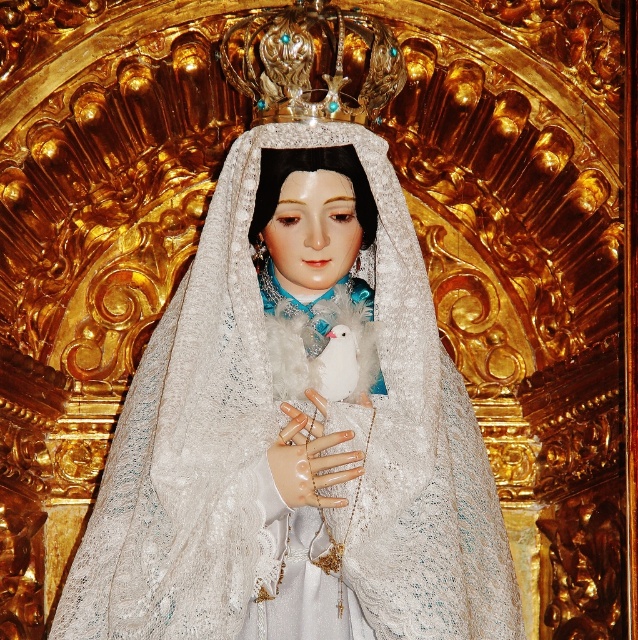
This screenshot has height=640, width=638. What are the coordinates of `lace fabric at center` in the screenshot? It's located at (297, 394).

Who is more distant from viewer, (508, 560) or (286, 490)?

Positioned behind is point (508, 560).

Does point (413, 340) come in front of point (297, 460)?

No.

You are a GUI agent. You are given a task and a screenshot of the screen. Output one action in this format:
    pyautogui.click(x=<x>, y=<y>)
    Task: Click on the lace fabric at center
    Image resolution: width=638 pixels, height=640 pixels.
    Given the screenshot: What is the action you would take?
    pyautogui.click(x=297, y=394)

Does smooth porcelain hand at center have a larger size compared to white fluffy bird at center?

No.

Does smooth porcelain hand at center have a lesser width compared to white fluffy bird at center?

Yes, smooth porcelain hand at center is thinner than white fluffy bird at center.

Describe the element at coordinates (309, 461) in the screenshot. This screenshot has width=638, height=640. I see `smooth porcelain hand at center` at that location.

Image resolution: width=638 pixels, height=640 pixels. I want to click on smooth porcelain hand at center, so click(x=309, y=461).

Measure the distance from lace fabric at center to white fluffy bird at center.

lace fabric at center and white fluffy bird at center are 6.22 meters apart.

Which is below, lace fabric at center or white fluffy bird at center?

white fluffy bird at center is lower down.

You are a GUI agent. You are given a task and a screenshot of the screen. Output one action in this format:
    pyautogui.click(x=<x>, y=<y>)
    Task: Click on the lace fabric at center
    
    Given the screenshot: What is the action you would take?
    (x=297, y=394)